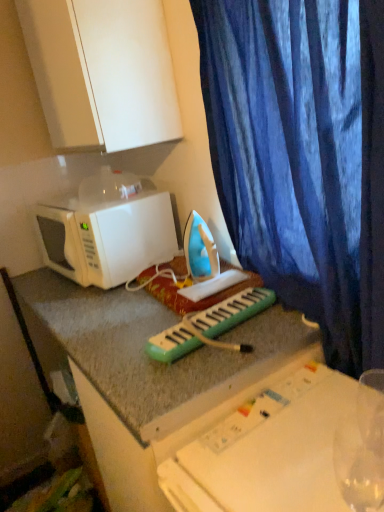
Locate an element on the screen. The image size is (384, 512). free spot above white plastic table at center (from a real-world perspective) is located at coordinates (296, 440).